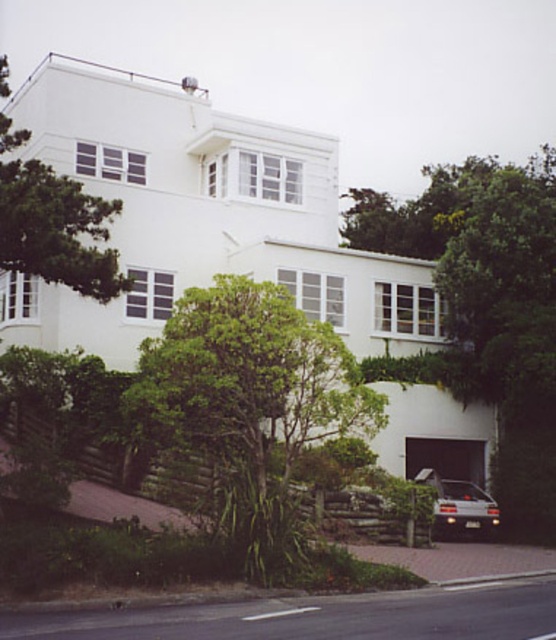
Question: Among these points, which one is farthest from the camera?

Choices:
 (A) (417, 476)
 (B) (325, 388)

Answer: (A)

Question: Is green leafy tree at center above silver metallic car at lower right?

Choices:
 (A) yes
 (B) no

Answer: (A)

Question: Is green leafy tree at center to the left of silver metallic car at lower right from the viewer's perspective?

Choices:
 (A) no
 (B) yes

Answer: (B)

Question: Does green leafy tree at center appear under silver metallic car at lower right?

Choices:
 (A) no
 (B) yes

Answer: (A)